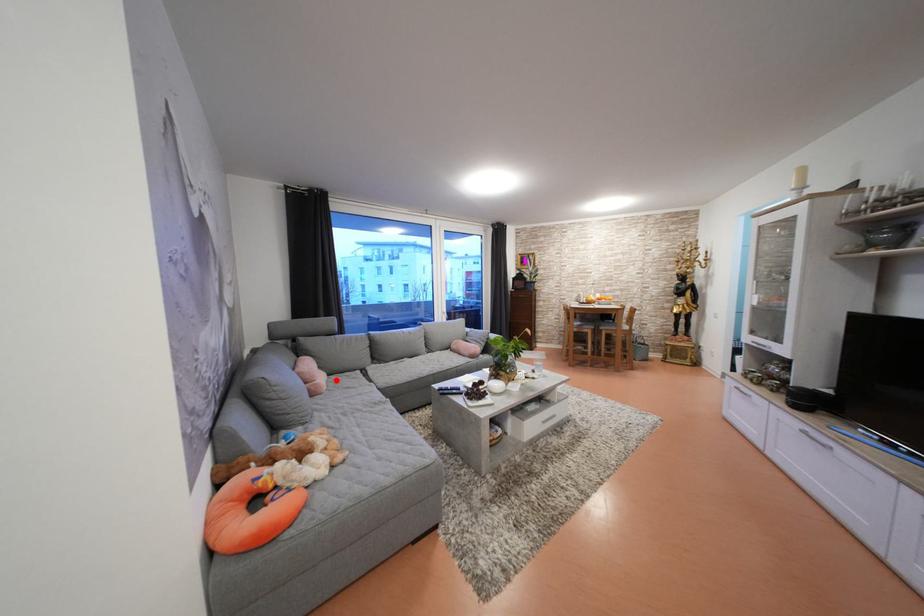
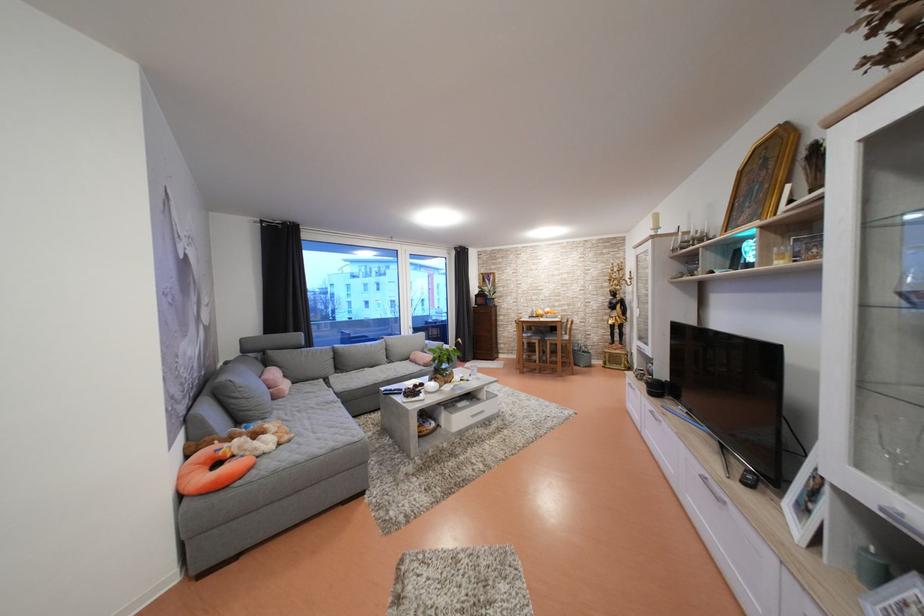
Question: I am providing you with two images of the same scene from different viewpoints. Given a red point in image1, look at the same physical point in image2. Is it:

Choices:
 (A) Closer to the viewpoint
 (B) Farther from the viewpoint

Answer: (B)